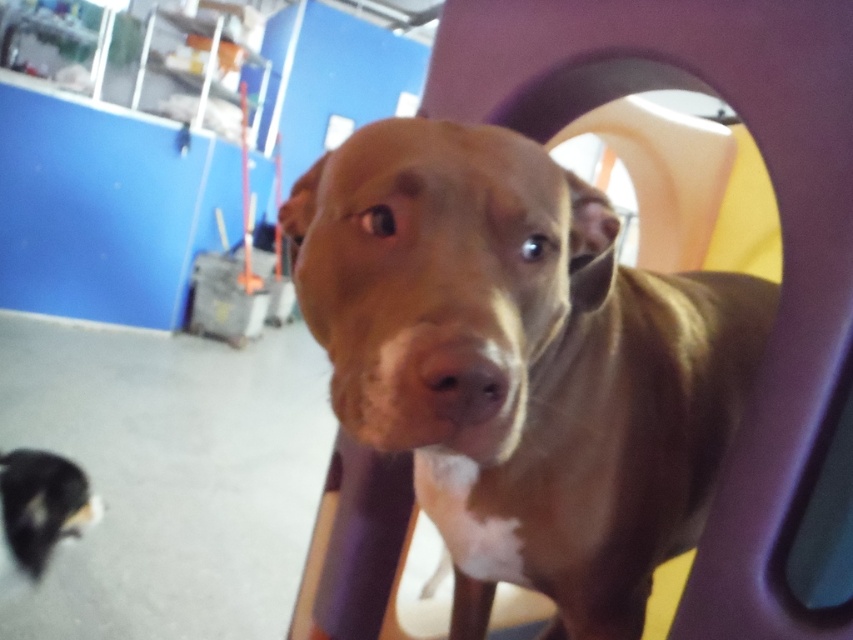
Is brown shiny dog at center to the right of black fur dog at lower left from the viewer's perspective?

Yes, brown shiny dog at center is to the right of black fur dog at lower left.

Does brown shiny dog at center appear under black fur dog at lower left?

No, brown shiny dog at center is not below black fur dog at lower left.

I want to click on brown shiny dog at center, so click(x=521, y=364).